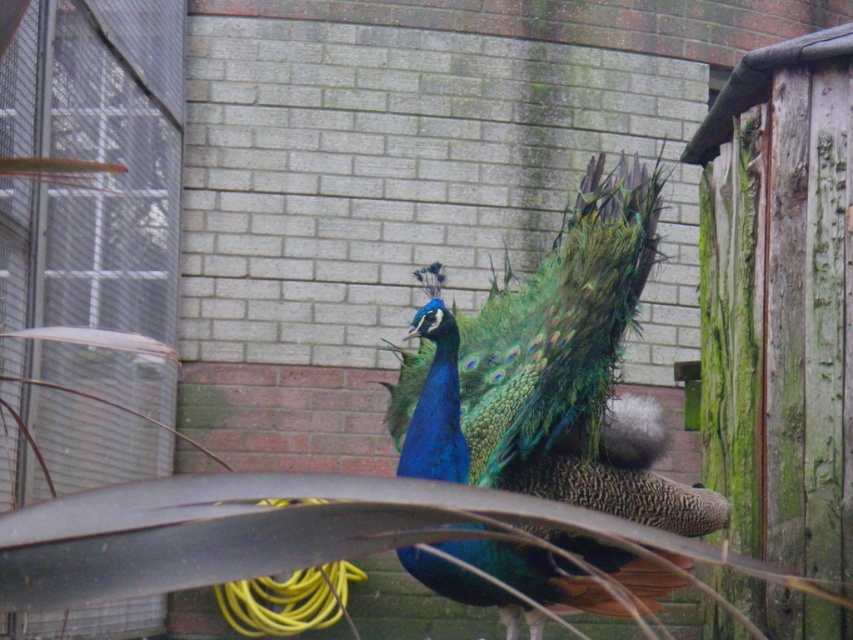
Question: Which of the following is the closest to the observer?

Choices:
 (A) shiny blue peacock at center
 (B) yellow rubber hose at lower center

Answer: (A)

Question: Which point appears closest to the camera in this image?

Choices:
 (A) (273, 624)
 (B) (473, 593)

Answer: (B)

Question: Can you confirm if shiny blue peacock at center is positioned above yellow rubber hose at lower center?

Choices:
 (A) yes
 (B) no

Answer: (A)

Question: Can you confirm if shiny blue peacock at center is positioned above yellow rubber hose at lower center?

Choices:
 (A) no
 (B) yes

Answer: (B)

Question: In this image, where is shiny blue peacock at center located relative to yellow rubber hose at lower center?

Choices:
 (A) below
 (B) above

Answer: (B)

Question: Among these objects, which one is nearest to the camera?

Choices:
 (A) yellow rubber hose at lower center
 (B) shiny blue peacock at center

Answer: (B)